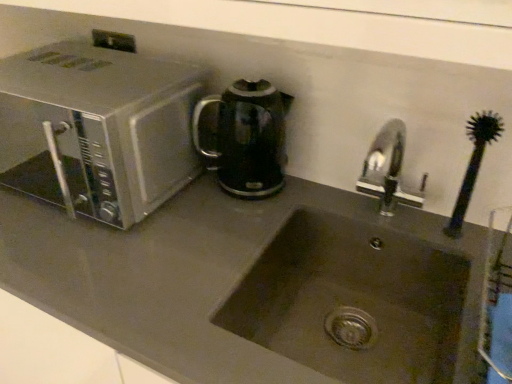
The width and height of the screenshot is (512, 384). Identify the location of metallic stainless steel at upper left. (312, 26).

Locate an element on the screen. The height and width of the screenshot is (384, 512). silver metallic microwave at left is located at coordinates (98, 129).

The image size is (512, 384). I want to click on metallic stainless steel at upper left, so click(x=312, y=26).

Could you tell me if matte stainless steel sink at center is turned towards silver metallic microwave at left?

No.

Is matte stainless steel sink at center in front of silver metallic microwave at left?

Yes, matte stainless steel sink at center is closer to the viewer.

Between matte stainless steel sink at center and silver metallic microwave at left, which one appears on the left side from the viewer's perspective?

From the viewer's perspective, silver metallic microwave at left appears more on the left side.

Which is behind, point (438, 263) or point (100, 114)?

Point (438, 263)

Considering their positions, is black glossy electric kettle at center located in front of or behind metallic stainless steel at upper left?

In the image, black glossy electric kettle at center appears behind metallic stainless steel at upper left.

Is there a large distance between black glossy electric kettle at center and metallic stainless steel at upper left?

No, black glossy electric kettle at center is not far from metallic stainless steel at upper left.

Which is correct: black glossy electric kettle at center is inside metallic stainless steel at upper left, or outside of it?

black glossy electric kettle at center is outside metallic stainless steel at upper left.

From a real-world perspective, is black glossy electric kettle at center located higher than metallic stainless steel at upper left?

No, from a real-world perspective, black glossy electric kettle at center is not over metallic stainless steel at upper left

How many degrees apart are the facing directions of slate gray stone sink at center and metallic stainless steel at upper left?

0.444 degrees separate the facing orientations of slate gray stone sink at center and metallic stainless steel at upper left.

Is slate gray stone sink at center facing away from metallic stainless steel at upper left?

No, slate gray stone sink at center is not facing away from metallic stainless steel at upper left.

Can you confirm if slate gray stone sink at center is smaller than metallic stainless steel at upper left?

Incorrect, slate gray stone sink at center is not smaller in size than metallic stainless steel at upper left.

Which is closer, (139,317) or (410,41)?

Point (139,317) is positioned farther from the camera compared to point (410,41).

How many degrees apart are the facing directions of metallic stainless steel at upper left and black glossy electric kettle at center?

They differ by 3.53 degrees in their facing directions.

Can you confirm if metallic stainless steel at upper left is positioned to the left of black glossy electric kettle at center?

Indeed, metallic stainless steel at upper left is positioned on the left side of black glossy electric kettle at center.

Is metallic stainless steel at upper left not within black glossy electric kettle at center?

That's correct, metallic stainless steel at upper left is outside of black glossy electric kettle at center.

From the picture: Is metallic stainless steel at upper left touching black glossy electric kettle at center?

No, metallic stainless steel at upper left is not beside black glossy electric kettle at center.

Can you confirm if silver metallic microwave at left is smaller than slate gray stone sink at center?

Indeed, silver metallic microwave at left has a smaller size compared to slate gray stone sink at center.

Is silver metallic microwave at left inside the boundaries of slate gray stone sink at center, or outside?

silver metallic microwave at left is not inside slate gray stone sink at center, it's outside.

From the image's perspective, between silver metallic microwave at left and slate gray stone sink at center, which one is located above?

silver metallic microwave at left.

Is silver metallic microwave at left looking in the opposite direction of slate gray stone sink at center?

No.

Between black glossy electric kettle at center and silver metallic microwave at left, which one has smaller width?

black glossy electric kettle at center is thinner.

Is black glossy electric kettle at center spatially inside silver metallic microwave at left, or outside of it?

black glossy electric kettle at center is spatially situated outside silver metallic microwave at left.

Is black glossy electric kettle at center at the left side of silver metallic microwave at left?

In fact, black glossy electric kettle at center is to the right of silver metallic microwave at left.

From the image's perspective, is black glossy electric kettle at center above silver metallic microwave at left?

Incorrect, from the image's perspective, black glossy electric kettle at center is lower than silver metallic microwave at left.

Is slate gray stone sink at center positioned with its back to silver metallic microwave at left?

No, silver metallic microwave at left is not at the back of slate gray stone sink at center.

Is slate gray stone sink at center bigger than silver metallic microwave at left?

Correct, slate gray stone sink at center is larger in size than silver metallic microwave at left.

Between slate gray stone sink at center and silver metallic microwave at left, which one has smaller width?

Thinner between the two is silver metallic microwave at left.

In the scene shown: Is slate gray stone sink at center spatially inside silver metallic microwave at left, or outside of it?

slate gray stone sink at center is outside silver metallic microwave at left.

This screenshot has width=512, height=384. I want to click on microwave oven positioned vertically above the matte stainless steel sink at center (from a real-world perspective), so 98,129.

The image size is (512, 384). Identify the location of kitchen appliance below the metallic stainless steel at upper left (from a real-world perspective). (247, 138).

From the picture: Which object lies further to the anchor point slate gray stone sink at center, silver metallic microwave at left or metallic stainless steel at upper left?

metallic stainless steel at upper left is positioned further to the anchor slate gray stone sink at center.

When comparing their distances from silver metallic microwave at left, does matte stainless steel sink at center or metallic stainless steel at upper left seem further?

The object further to silver metallic microwave at left is matte stainless steel sink at center.

Consider the image. Considering their positions, is slate gray stone sink at center positioned closer to matte stainless steel sink at center than black glossy electric kettle at center?

slate gray stone sink at center is closer to matte stainless steel sink at center.

Which object lies nearer to the anchor point silver metallic microwave at left, black glossy electric kettle at center or matte stainless steel sink at center?

Based on the image, black glossy electric kettle at center appears to be nearer to silver metallic microwave at left.

From the image, which object appears to be nearer to black glossy electric kettle at center, matte stainless steel sink at center or silver metallic microwave at left?

Among the two, silver metallic microwave at left is located nearer to black glossy electric kettle at center.

Based on their spatial positions, is metallic stainless steel at upper left or black glossy electric kettle at center further from slate gray stone sink at center?

metallic stainless steel at upper left.

Considering their positions, is metallic stainless steel at upper left positioned further to slate gray stone sink at center than matte stainless steel sink at center?

metallic stainless steel at upper left.

In the scene shown: When comparing their distances from matte stainless steel sink at center, does silver metallic microwave at left or black glossy electric kettle at center seem further?

silver metallic microwave at left lies further to matte stainless steel sink at center than the other object.

You are a GUI agent. You are given a task and a screenshot of the screen. Output one action in this format:
    pyautogui.click(x=<x>, y=<y>)
    Task: Click on the kitchen appliance between silver metallic microwave at left and slate gray stone sink at center in the up-down direction
    This screenshot has height=384, width=512.
    Given the screenshot: What is the action you would take?
    pyautogui.click(x=247, y=138)

Image resolution: width=512 pixels, height=384 pixels. Identify the location of sink between metallic stainless steel at upper left and slate gray stone sink at center from top to bottom. (354, 293).

I want to click on microwave oven between metallic stainless steel at upper left and matte stainless steel sink at center in the up-down direction, so click(x=98, y=129).

This screenshot has height=384, width=512. In order to click on microwave oven between metallic stainless steel at upper left and slate gray stone sink at center vertically in this screenshot , I will do `click(98, 129)`.